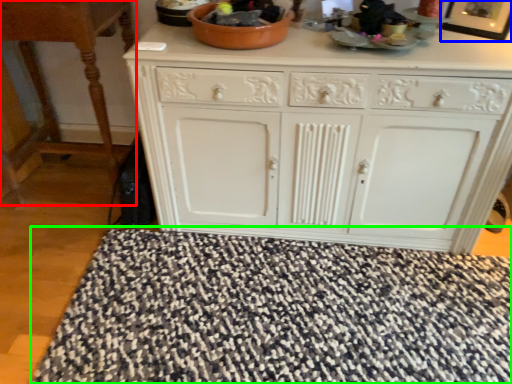
Question: Considering the real-world distances, which object is closest to table (highlighted by a red box)? picture frame (highlighted by a blue box) or doormat (highlighted by a green box).

Choices:
 (A) picture frame
 (B) doormat

Answer: (B)